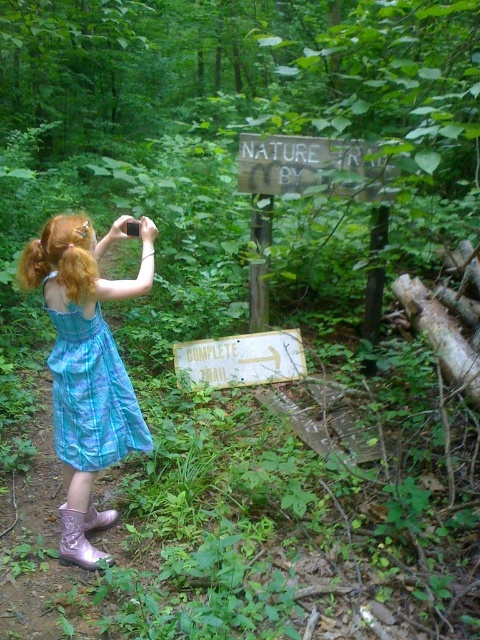
At what (x,y) coordinates should I click in order to perform the action: click on shiny blue dress at center. Please return your answer as a coordinate pair (x, y). Looking at the image, I should click on (86, 368).

Is point (75, 392) closer to viewer compared to point (76, 298)?

No, (75, 392) is behind (76, 298).

This screenshot has width=480, height=640. In order to click on shiny blue dress at center in this screenshot , I will do `click(86, 368)`.

From the picture: Is blonde silky hair at left to the left of pink rubber boot at lower left from the viewer's perspective?

Yes, blonde silky hair at left is to the left of pink rubber boot at lower left.

Can you confirm if blonde silky hair at left is positioned above pink rubber boot at lower left?

Correct, blonde silky hair at left is located above pink rubber boot at lower left.

Describe the element at coordinates (61, 257) in the screenshot. This screenshot has height=640, width=480. I see `blonde silky hair at left` at that location.

This screenshot has width=480, height=640. In order to click on blonde silky hair at left in this screenshot , I will do `click(61, 257)`.

Is shiny blue dress at center above pink rubber boot at lower left?

Correct, shiny blue dress at center is located above pink rubber boot at lower left.

Between shiny blue dress at center and pink rubber boot at lower left, which one has less height?

Standing shorter between the two is pink rubber boot at lower left.

Where is `shiny blue dress at center`? The height and width of the screenshot is (640, 480). shiny blue dress at center is located at coordinates (86, 368).